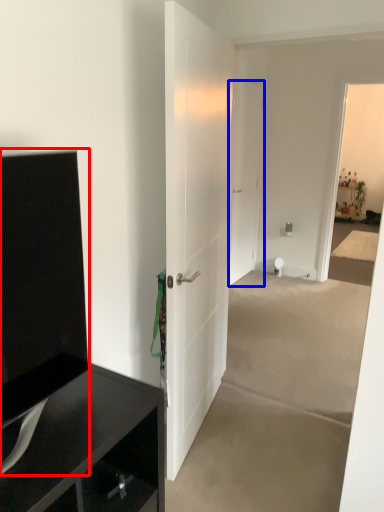
Question: Which point is further to the camera, tv cabinet (highlighted by a red box) or door (highlighted by a blue box)?

Choices:
 (A) tv cabinet
 (B) door

Answer: (B)